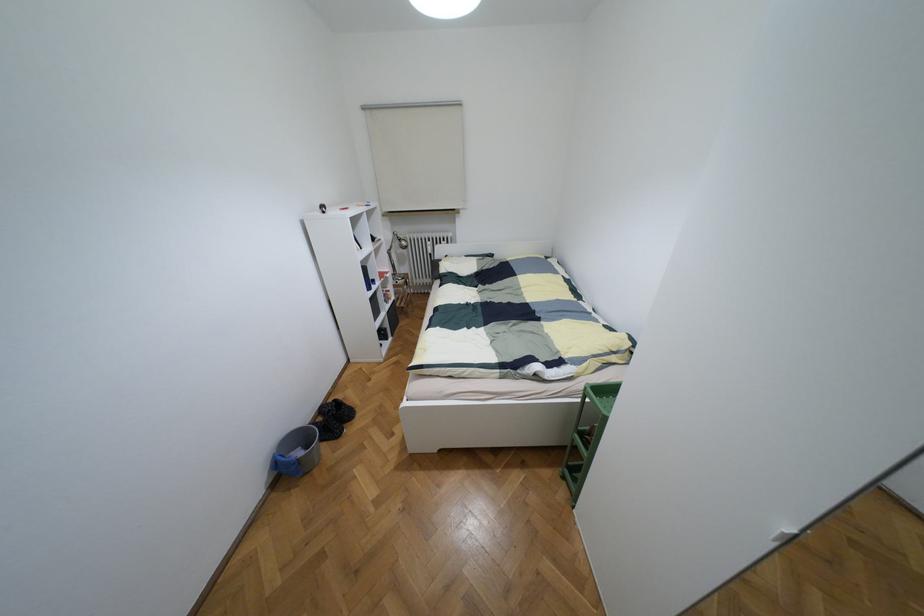
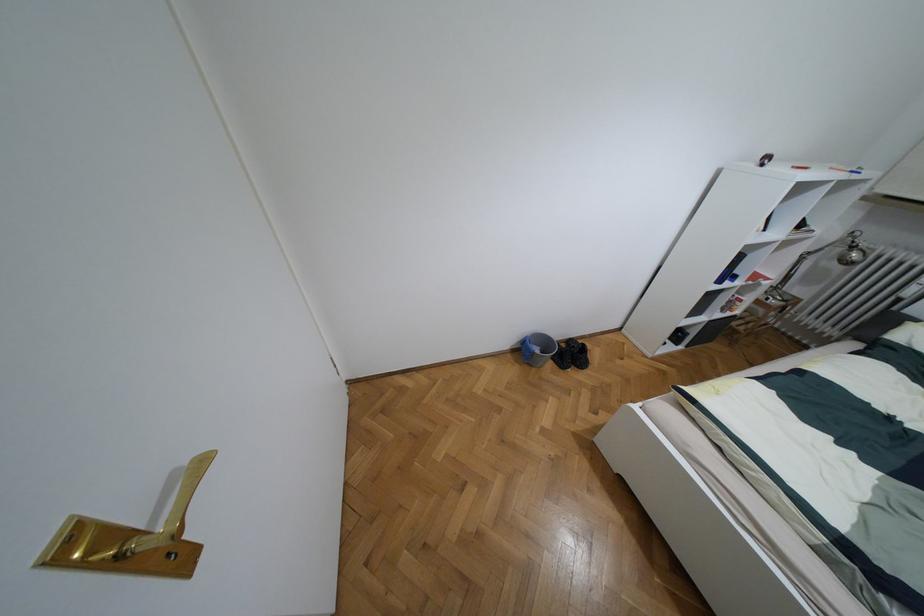
The point at (334, 400) is marked in the first image. Where is the corresponding point in the second image?

(582, 344)